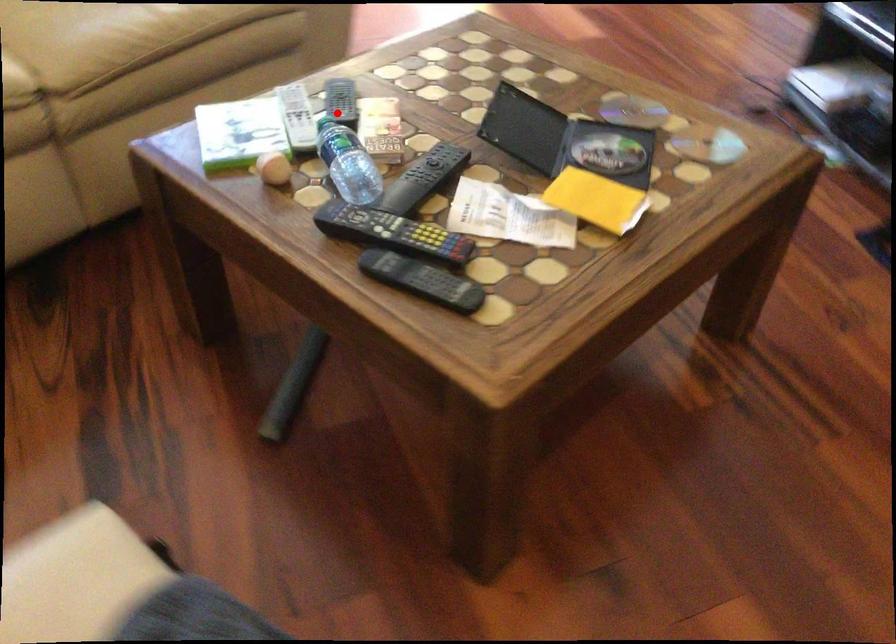
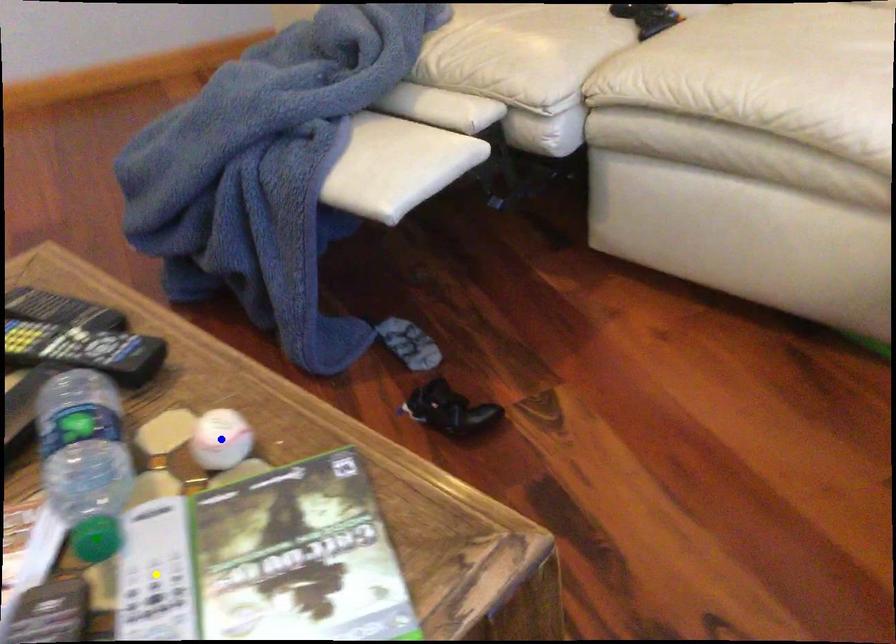
Question: I am providing you with two images of the same scene from different viewpoints. A red point is marked on the first image. You are given multiple points on the second image. Which point in image 2 is actually the same real-world point as the red point in image 1?

Choices:
 (A) green point
 (B) blue point
 (C) yellow point

Answer: (A)